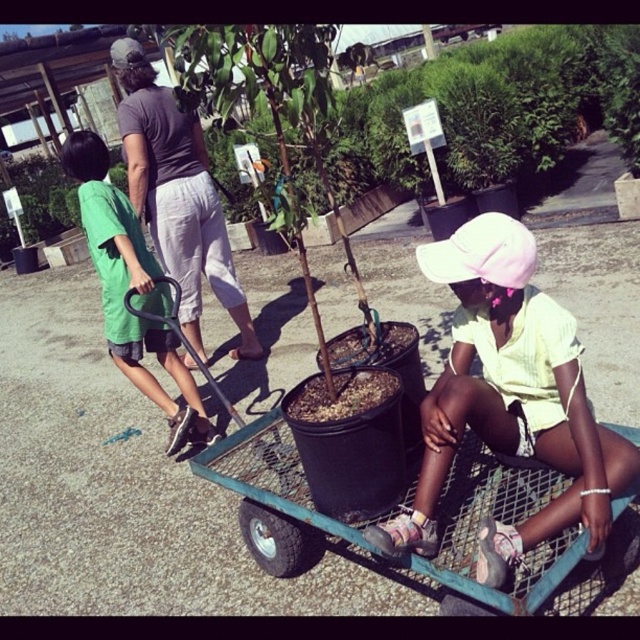
You are standing in the plant nursery and want to place a new pot between the two points marked as point (157,86) and point (113,211). Which point should the pot be closer to in order to be closer to the viewer?

The pot should be placed closer to point (157,86) because it is closer to the viewer compared to point (113,211).

You are a customer at the nursery and want to know which item is narrower between the white matte hat at center and the gray cotton shirt at upper left. Can you tell me?

The white matte hat at center has a lesser width compared to the gray cotton shirt at upper left, so the white matte hat at center is narrower.